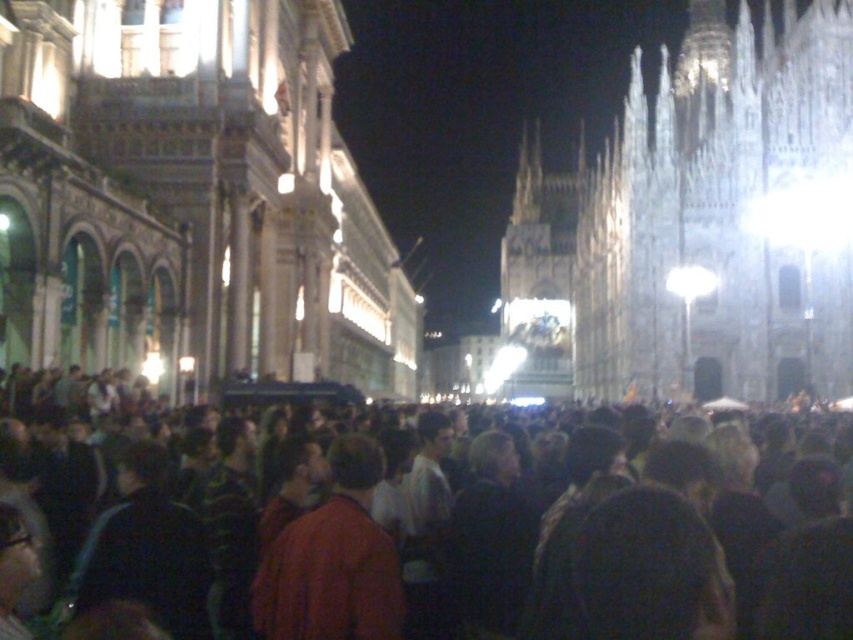
You are standing in the public square and want to take a photo of both the stone church at center and the white stone church at upper right. Which church should you move closer to in order to include both in your photo frame?

Since the stone church at center is 152.84 feet away from the white stone church at upper right, you should move closer to the stone church at center to include both in your photo frame.

In the scene shown: You are standing at the red matte jacket at center in the nighttime square. The white stone church at upper right has a bell tower that rings every hour. If you want to hear the next bell sound clearly, should you stay at your current position or move closer to the church?

The distance between the white stone church at upper right and the red matte jacket at center is 89.09 meters. Since sound travels at approximately 343 meters per second in air, the time it would take for the bell sound to reach you is about 0.26 seconds. This delay is negligible for human perception, so staying at the current position would allow you to hear the bell clearly without needing to move closer.

Looking at this image, you are standing in the public square and want to take a photo of both the stone church at center and the white stone church at upper right. Which church should you position yourself closer to in order to capture both in a single frame?

You should position yourself closer to the stone church at center because it is to the left of the white stone church at upper right, allowing both to be included in the frame when centered.